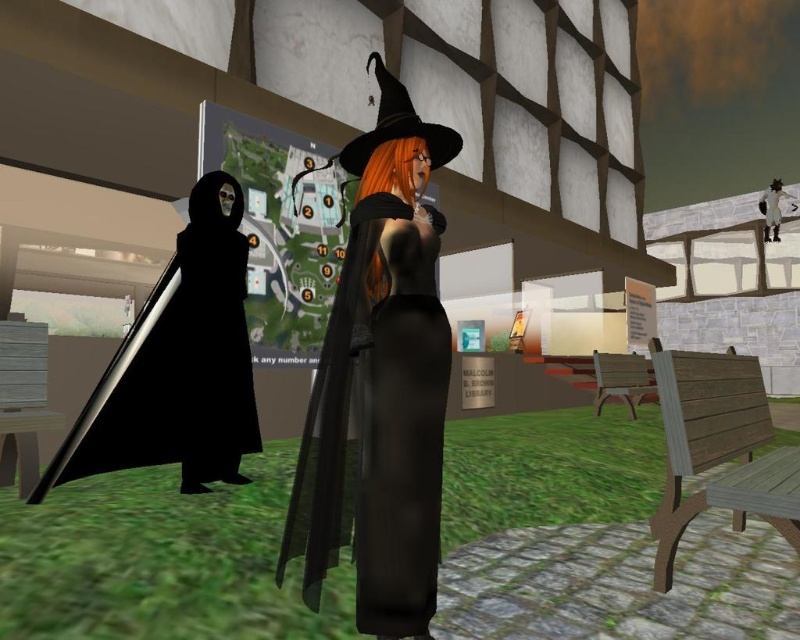
Looking at this image, is matte black witch hat at center to the left of black matte cloak at left from the viewer's perspective?

In fact, matte black witch hat at center is to the right of black matte cloak at left.

Between matte black witch hat at center and black matte cloak at left, which one appears on the right side from the viewer's perspective?

matte black witch hat at center

Does point (409, 577) come in front of point (228, 296)?

Yes, point (409, 577) is closer to viewer.

Where is `matte black witch hat at center`? The width and height of the screenshot is (800, 640). matte black witch hat at center is located at coordinates (380, 385).

Is matte black witch hat at center behind matte black witch hat at upper center?

No.

Is matte black witch hat at center wider than matte black witch hat at upper center?

Indeed, matte black witch hat at center has a greater width compared to matte black witch hat at upper center.

What are the coordinates of `matte black witch hat at center` in the screenshot? It's located at (380, 385).

Which is in front, point (337, 522) or point (770, 237)?

Positioned in front is point (337, 522).

This screenshot has width=800, height=640. Describe the element at coordinates (380, 385) in the screenshot. I see `matte black witch hat at center` at that location.

What do you see at coordinates (380, 385) in the screenshot? The height and width of the screenshot is (640, 800). I see `matte black witch hat at center` at bounding box center [380, 385].

Where is `matte black witch hat at center`? matte black witch hat at center is located at coordinates (380, 385).